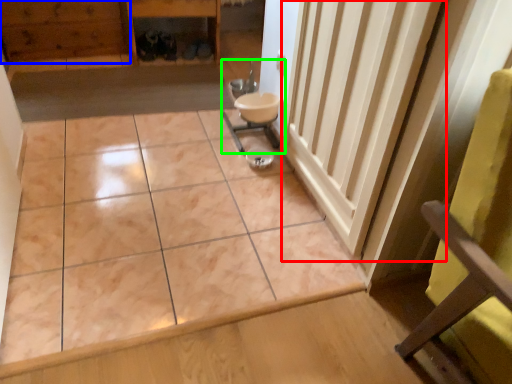
Question: Considering the real-world distances, which object is farthest from radiator (highlighted by a red box)? hardwood (highlighted by a blue box) or sink (highlighted by a green box)?

Choices:
 (A) hardwood
 (B) sink

Answer: (A)